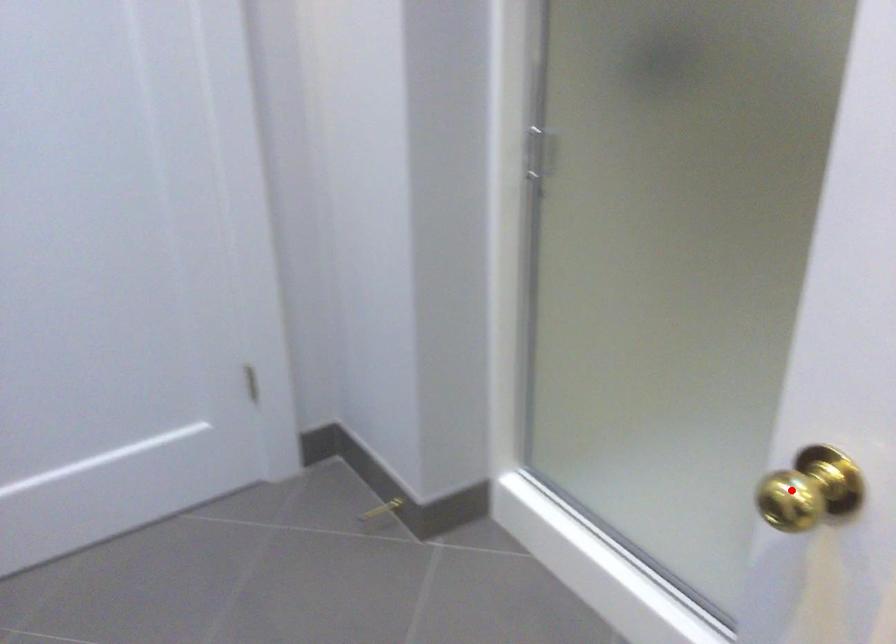
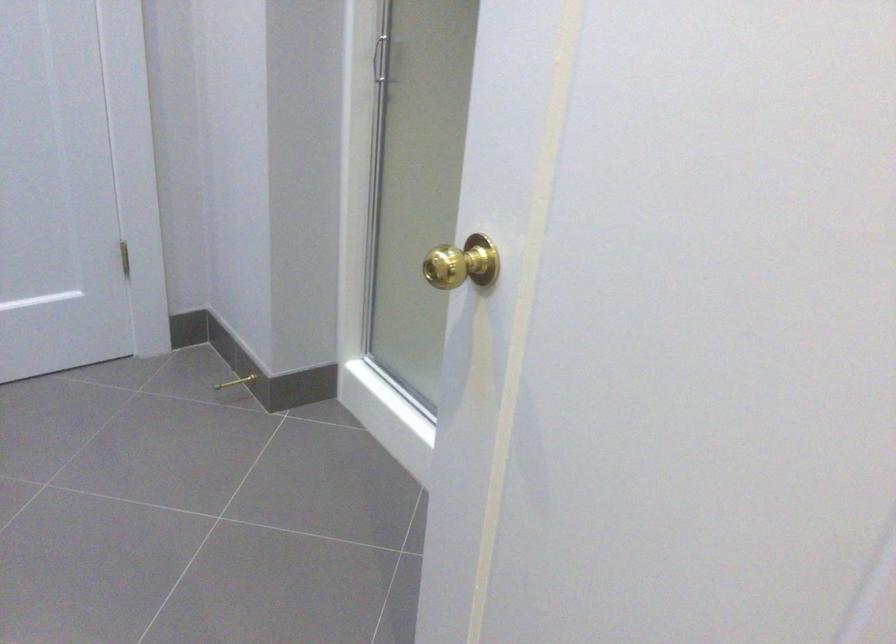
Question: A red point is marked in image1. In image2, is the corresponding 3D point closer to the camera or farther? Reply with the corresponding letter.

Choices:
 (A) The corresponding 3D point is closer.
 (B) The corresponding 3D point is farther.

Answer: (B)